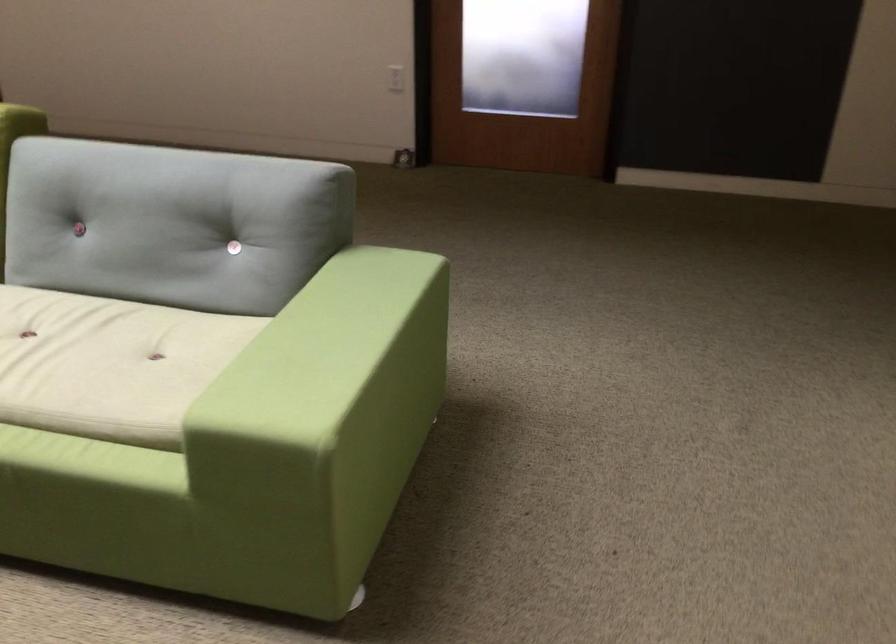
Find where to sit the sofa sitting surface. Please return your answer as a coordinate pair (x, y).

(109, 364)